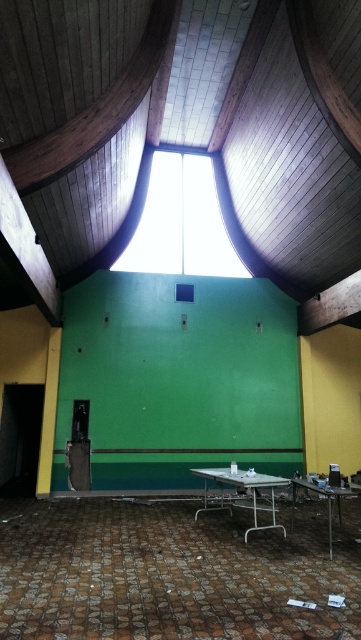
You are standing in the room and want to let more natural light into the space. Which object, the transparent glass window at center or the metallic silver table at lower right, should you adjust to achieve this goal?

The transparent glass window at center is much taller than the metallic silver table at lower right, so adjusting the window would allow more natural light into the space.

You are planning to place a large potted plant on the floor between the metallic silver table at center and the metallic silver table at lower right. Given their widths, which table will require more space to accommodate the plant without touching either table?

The metallic silver table at center has a greater width than the metallic silver table at lower right, so it will require more space to accommodate the plant without touching either table.